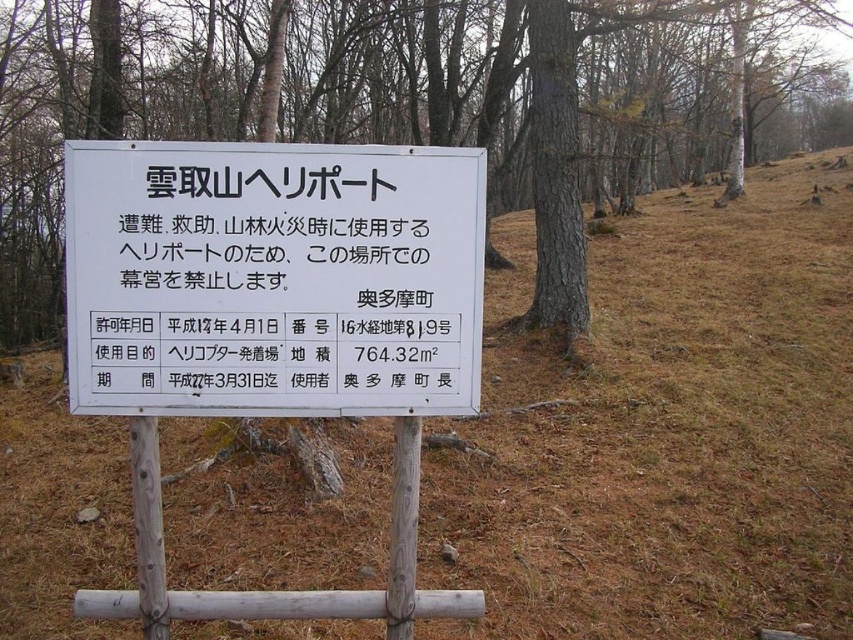
Question: Does brown bark tree at center have a smaller size compared to white plastic sign at center?

Choices:
 (A) no
 (B) yes

Answer: (A)

Question: Is brown bark tree at center further to camera compared to white plastic sign at center?

Choices:
 (A) no
 (B) yes

Answer: (B)

Question: Where is brown bark tree at center located in relation to white plastic sign at center in the image?

Choices:
 (A) above
 (B) below

Answer: (A)

Question: Which point is closer to the camera?

Choices:
 (A) (42, 252)
 (B) (339, 250)

Answer: (B)

Question: Which of the following is the farthest from the observer?

Choices:
 (A) white plastic sign at center
 (B) brown bark tree at center

Answer: (B)

Question: Which object appears farthest from the camera in this image?

Choices:
 (A) brown bark tree at center
 (B) white plastic sign at center

Answer: (A)